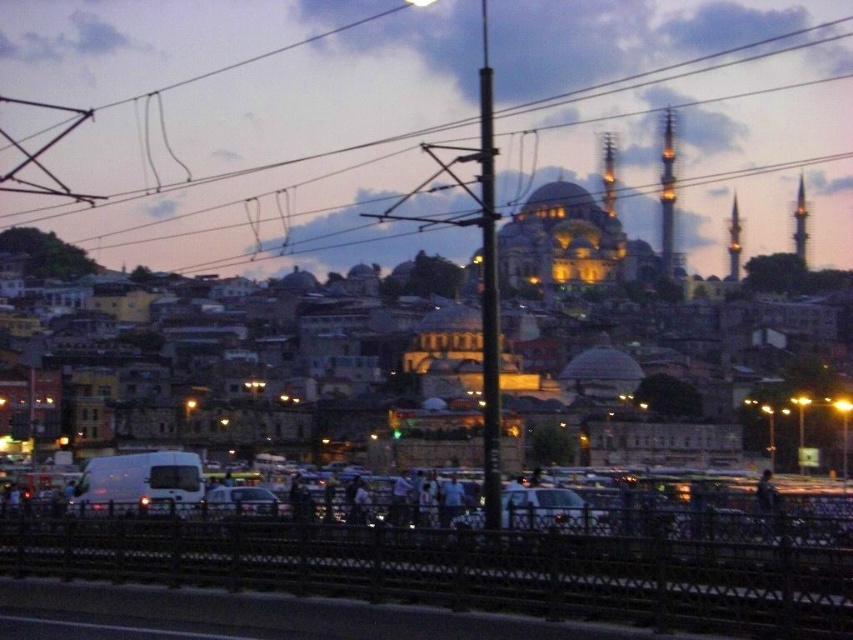
Question: Is metallic wire at upper center smaller than white glossy car at center?

Choices:
 (A) yes
 (B) no

Answer: (B)

Question: Which object is farther from the camera taking this photo?

Choices:
 (A) white glossy car at center
 (B) white matte car at center

Answer: (B)

Question: Does metallic wire at upper center appear on the left side of white matte car at center?

Choices:
 (A) yes
 (B) no

Answer: (B)

Question: Which of these objects is positioned closest to the white glossy car at center?

Choices:
 (A) metallic wire at upper center
 (B) white matte car at center

Answer: (B)

Question: Does metallic wire at upper center have a smaller size compared to white glossy car at center?

Choices:
 (A) no
 (B) yes

Answer: (A)

Question: Which object is farther from the camera taking this photo?

Choices:
 (A) white glossy car at center
 (B) metallic wire at upper center

Answer: (B)